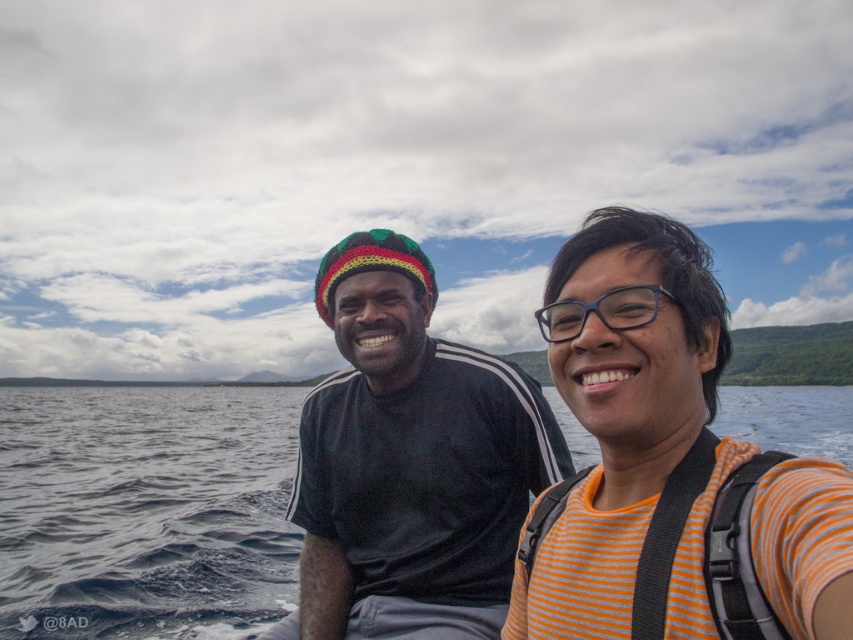
Consider the image. Between dark blue water at center and black knitted hat at center, which one is positioned higher?

black knitted hat at center is higher up.

Is dark blue water at center closer to the viewer compared to black knitted hat at center?

Yes, it is.

This screenshot has width=853, height=640. In order to click on dark blue water at center in this screenshot , I will do `click(146, 509)`.

Locate an element on the screen. orange striped shirt at right is located at coordinates (664, 460).

Is orange striped shirt at right taller than dark blue water at center?

Incorrect, orange striped shirt at right's height is not larger of dark blue water at center's.

Does point (682, 305) come closer to viewer compared to point (276, 499)?

Yes, it is.

The image size is (853, 640). I want to click on orange striped shirt at right, so [x=664, y=460].

Does dark blue water at center have a lesser height compared to transparent plastic glasses at center?

No.

This screenshot has height=640, width=853. Find the location of `dark blue water at center`. dark blue water at center is located at coordinates (146, 509).

The height and width of the screenshot is (640, 853). What are the coordinates of `dark blue water at center` in the screenshot? It's located at (146, 509).